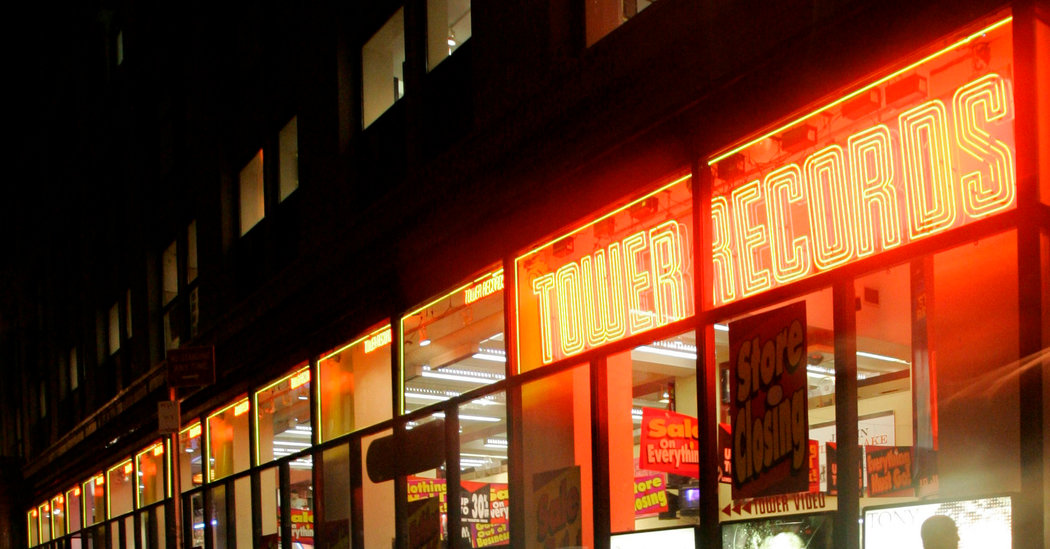
Where is `florescent ceiling lights inside store`? The image size is (1050, 549). florescent ceiling lights inside store is located at coordinates (442, 374), (414, 397), (307, 432), (288, 442), (818, 369), (672, 352), (492, 347).